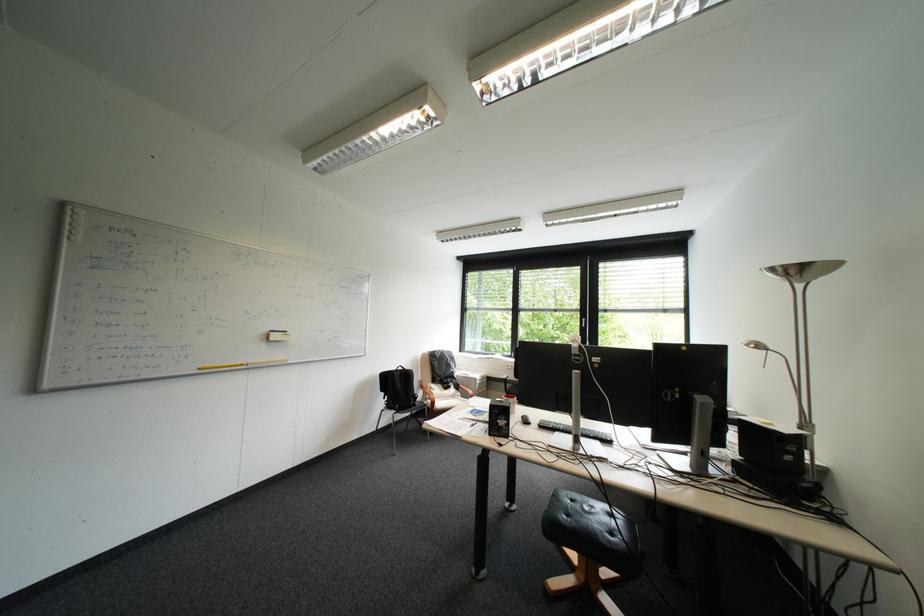
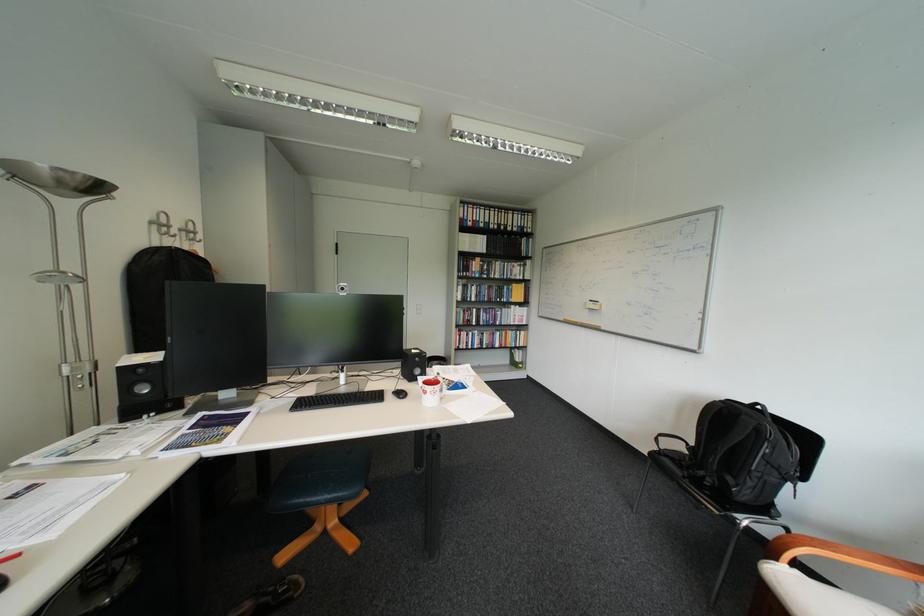
Locate, in the second image, the point that corresponds to (446,403) in the first image.

(788, 560)